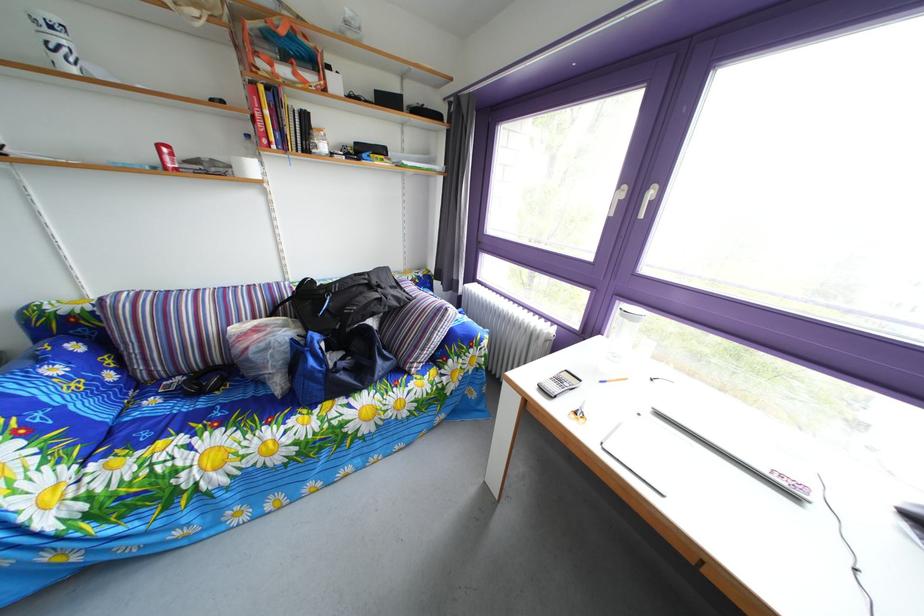
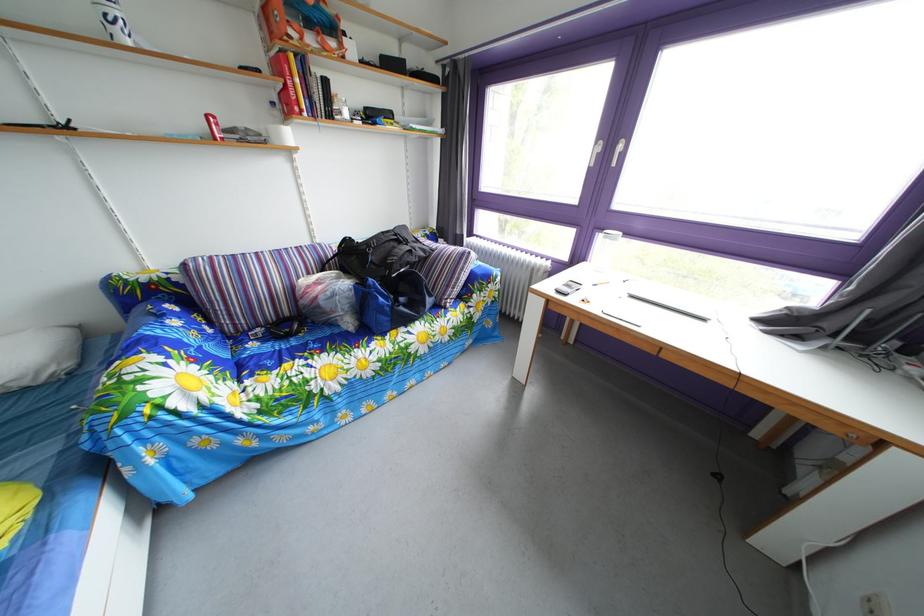
In the second image, find the point that corresponds to the point at 391,309 in the first image.

(421, 260)